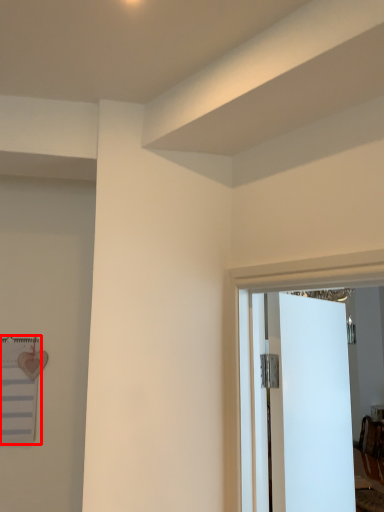
Question: Observing the image, what is the correct spatial positioning of bulletin board (annotated by the red box) in reference to door?

Choices:
 (A) right
 (B) left

Answer: (B)